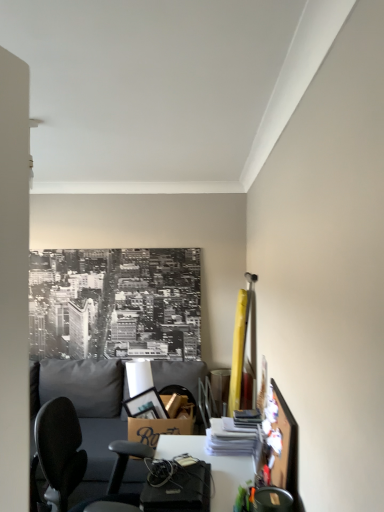
The image size is (384, 512). What do you see at coordinates (163, 423) in the screenshot? I see `brown cardboard box at center` at bounding box center [163, 423].

In order to face white glossy desk at center, should I rotate leftwards or rightwards?

Rotate right and turn 2.285 degrees.

Measure the distance between point (88, 388) and camera.

Point (88, 388) and camera are 11.21 feet apart from each other.

The image size is (384, 512). In order to click on metallic gray chair at lower right in this screenshot , I will do `click(272, 500)`.

Between white glossy desk at center and metallic gray chair at lower right, which one has smaller width?

Answer: With smaller width is metallic gray chair at lower right.

In the image, is white glossy desk at center on the left side or the right side of metallic gray chair at lower right?

In the image, white glossy desk at center appears on the left side of metallic gray chair at lower right.

Is white glossy desk at center with metallic gray chair at lower right?

They are not placed beside each other.

Looking at this image, between metallic gray chair at lower right and brown cardboard box at center, which one appears on the right side from the viewer's perspective?

Positioned to the right is metallic gray chair at lower right.

Is metallic gray chair at lower right taller or shorter than brown cardboard box at center?

metallic gray chair at lower right is shorter than brown cardboard box at center.

In terms of width, does metallic gray chair at lower right look wider or thinner when compared to brown cardboard box at center?

Clearly, metallic gray chair at lower right has less width compared to brown cardboard box at center.

From the image's perspective, does metallic gray chair at lower right appear lower than brown cardboard box at center?

No, from the image's perspective, metallic gray chair at lower right is not beneath brown cardboard box at center.

From a real-world perspective, relative to white glossy desk at center, is gray fabric couch at lower left vertically above or below?

In terms of real-world spatial position, gray fabric couch at lower left is below white glossy desk at center.

From the picture: Can you confirm if gray fabric couch at lower left is bigger than white glossy desk at center?

Yes, gray fabric couch at lower left is bigger than white glossy desk at center.

Is point (106, 405) positioned in front of point (208, 461)?

That is False.

Is gray fabric couch at lower left directly adjacent to white glossy desk at center?

No, gray fabric couch at lower left is not next to white glossy desk at center.

Would you say white glossy desk at center is inside or outside brown cardboard box at center?

white glossy desk at center is located beyond the bounds of brown cardboard box at center.

Would you consider white glossy desk at center to be distant from brown cardboard box at center?

No, white glossy desk at center is in close proximity to brown cardboard box at center.

Is white glossy desk at center taller or shorter than brown cardboard box at center?

Clearly, white glossy desk at center is taller compared to brown cardboard box at center.

Looking at this image, considering the sizes of objects gray fabric couch at lower left and metallic gray chair at lower right in the image provided, who is shorter, gray fabric couch at lower left or metallic gray chair at lower right?

metallic gray chair at lower right.

Does gray fabric couch at lower left contain metallic gray chair at lower right?

No, gray fabric couch at lower left does not contain metallic gray chair at lower right.

Can you confirm if gray fabric couch at lower left is bigger than metallic gray chair at lower right?

Indeed, gray fabric couch at lower left has a larger size compared to metallic gray chair at lower right.

Consider the image. Considering their positions, is gray fabric couch at lower left located in front of or behind metallic gray chair at lower right?

In the image, gray fabric couch at lower left appears behind metallic gray chair at lower right.

From the image's perspective, which object appears higher, brown cardboard box at center or white glossy desk at center?

From the image's view, brown cardboard box at center is above.

Is brown cardboard box at center bigger or smaller than white glossy desk at center?

Considering their sizes, brown cardboard box at center takes up less space than white glossy desk at center.

Is brown cardboard box at center turned away from white glossy desk at center?

No, brown cardboard box at center is not facing the opposite direction of white glossy desk at center.

From a real-world perspective, between brown cardboard box at center and white glossy desk at center, who is vertically lower?

white glossy desk at center is physically lower.

Is brown cardboard box at center situated inside metallic gray chair at lower right or outside?

brown cardboard box at center is spatially situated outside metallic gray chair at lower right.

Based on their sizes in the image, would you say brown cardboard box at center is bigger or smaller than metallic gray chair at lower right?

Considering their sizes, brown cardboard box at center takes up more space than metallic gray chair at lower right.

Between brown cardboard box at center and metallic gray chair at lower right, which one has more height?

brown cardboard box at center.

Considering the positions of objects brown cardboard box at center and metallic gray chair at lower right in the image provided, who is behind, brown cardboard box at center or metallic gray chair at lower right?

brown cardboard box at center is more distant.

This screenshot has height=512, width=384. Find the location of `chair that appears above the white glossy desk at center (from the image's perspective)`. chair that appears above the white glossy desk at center (from the image's perspective) is located at coordinates (272, 500).

I want to click on box below the metallic gray chair at lower right (from a real-world perspective), so click(x=163, y=423).

Considering their positions, is gray fabric couch at lower left positioned closer to brown cardboard box at center than white glossy desk at center?

white glossy desk at center is closer to brown cardboard box at center.

Looking at this image, considering their positions, is brown cardboard box at center positioned closer to white glossy desk at center than metallic gray chair at lower right?

brown cardboard box at center is positioned closer to the anchor white glossy desk at center.

Estimate the real-world distances between objects in this image. Which object is closer to white glossy desk at center, metallic gray chair at lower right or gray fabric couch at lower left?

metallic gray chair at lower right.

In the scene shown: From the image, which object appears to be farther from gray fabric couch at lower left, brown cardboard box at center or metallic gray chair at lower right?

Among the two, metallic gray chair at lower right is located further to gray fabric couch at lower left.

Considering their positions, is white glossy desk at center positioned closer to brown cardboard box at center than metallic gray chair at lower right?

white glossy desk at center.

Considering their positions, is metallic gray chair at lower right positioned closer to white glossy desk at center than brown cardboard box at center?

Among the two, brown cardboard box at center is located nearer to white glossy desk at center.

Which object lies further to the anchor point white glossy desk at center, gray fabric couch at lower left or brown cardboard box at center?

gray fabric couch at lower left lies further to white glossy desk at center than the other object.

Consider the image. Based on their spatial positions, is gray fabric couch at lower left or metallic gray chair at lower right further from white glossy desk at center?

gray fabric couch at lower left lies further to white glossy desk at center than the other object.

Find the location of a particular element. This screenshot has height=512, width=384. desk between metallic gray chair at lower right and gray fabric couch at lower left from front to back is located at coordinates (211, 467).

At what (x,y) coordinates should I click in order to perform the action: click on couch positioned between metallic gray chair at lower right and brown cardboard box at center from near to far. Please return your answer as a coordinate pair (x, y). Looking at the image, I should click on (86, 405).

Locate an element on the screen. Image resolution: width=384 pixels, height=512 pixels. desk positioned between metallic gray chair at lower right and brown cardboard box at center from near to far is located at coordinates (211, 467).

You are a GUI agent. You are given a task and a screenshot of the screen. Output one action in this format:
    pyautogui.click(x=<x>, y=<y>)
    Task: Click on the couch between white glossy desk at center and brown cardboard box at center along the z-axis
    
    Given the screenshot: What is the action you would take?
    pyautogui.click(x=86, y=405)